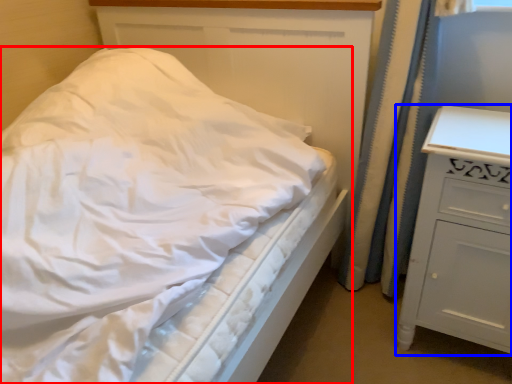
Question: Which point is closer to the camera, bed (highlighted by a red box) or chest of drawers (highlighted by a blue box)?

Choices:
 (A) bed
 (B) chest of drawers

Answer: (A)